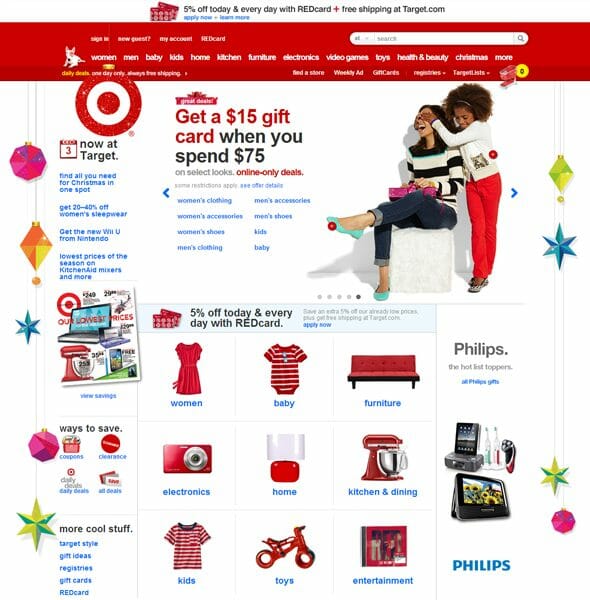
You are a GUI agent. You are given a task and a screenshot of the screen. Output one action in this format:
    pyautogui.click(x=<x>, y=<y>)
    Task: Click on the mixer
    The height and width of the screenshot is (600, 590).
    Given the screenshot: What is the action you would take?
    pyautogui.click(x=388, y=456), pyautogui.click(x=77, y=359)